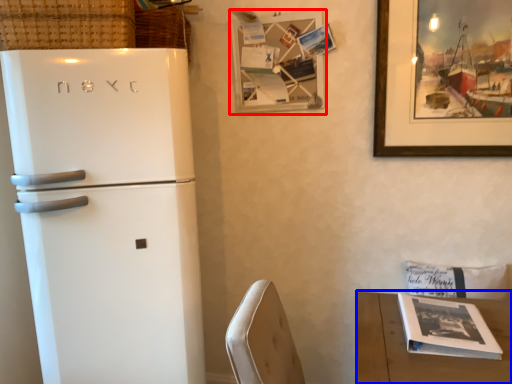
Question: Among these objects, which one is nearest to the camera, picture frame (highlighted by a red box) or table (highlighted by a blue box)?

Choices:
 (A) picture frame
 (B) table

Answer: (B)